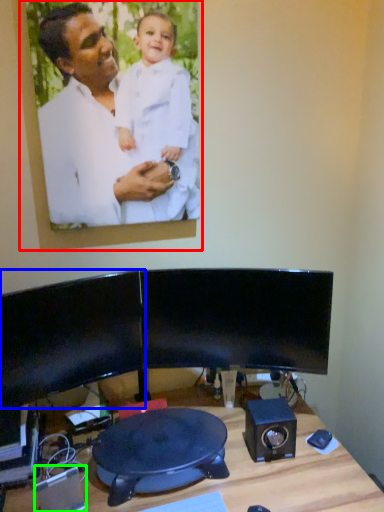
Question: Which is nearer to the picture frame (highlighted by a red box)? computer monitor (highlighted by a blue box) or speaker (highlighted by a green box).

Choices:
 (A) computer monitor
 (B) speaker

Answer: (A)